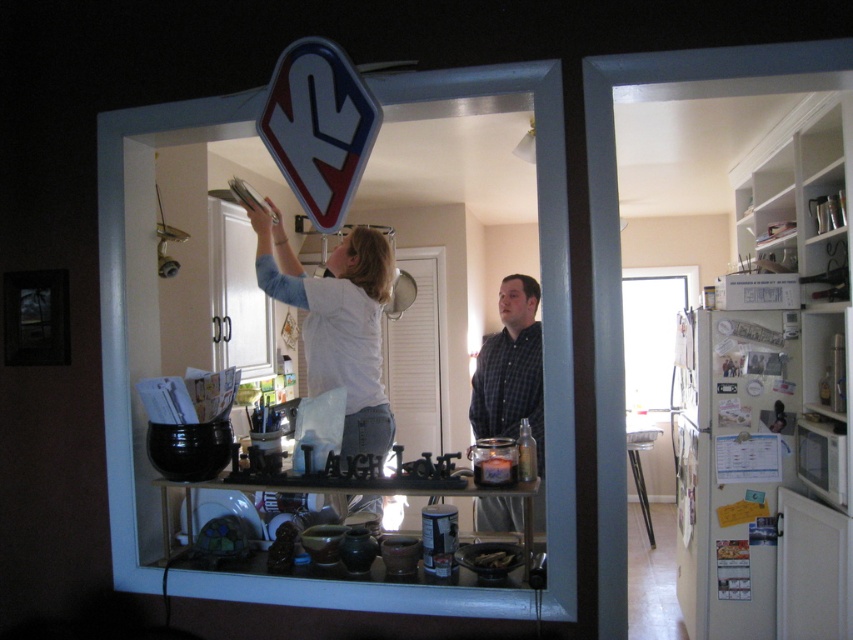
You are standing in a room and see your reflection in a mirror. In the reflection, you notice a metallic blue and white traffic sign at upper center and a checkered fabric shirt at center. Which object is located more to the left in the reflection?

The metallic blue and white traffic sign at upper center is positioned more to the left in the reflection than the checkered fabric shirt at center.

You are a delivery person who needs to place a 26 inch package between the white matte shirt at upper center and the metallic blue and white traffic sign at upper center in the reflection. Can the package fit between them without overlapping either object?

The distance between the white matte shirt at upper center and the metallic blue and white traffic sign at upper center is 26.74 inches, so the 26 inch package can fit between them without overlapping either object.

You are standing in the kitchen and looking at the mirror. You see two shirts reflected in the mirror. Which shirt, the white matte shirt at upper center or the checkered fabric shirt at center, is closer to you?

The white matte shirt at upper center is closer to you because it is further to the viewer than the checkered fabric shirt at center in the reflection.